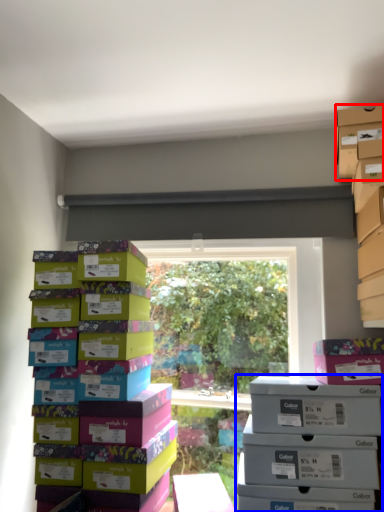
Question: Which point is further to the camera, storage box (highlighted by a red box) or storage box (highlighted by a blue box)?

Choices:
 (A) storage box
 (B) storage box

Answer: (A)